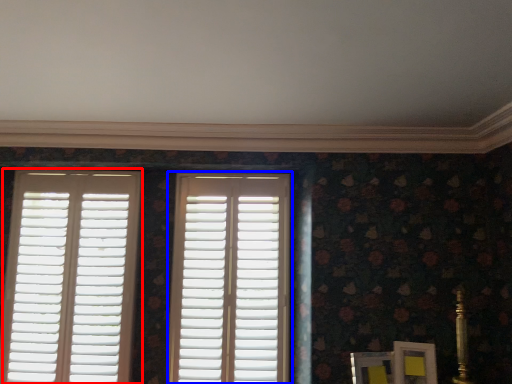
Question: Which object appears farthest to the camera in this image, window (highlighted by a red box) or window (highlighted by a blue box)?

Choices:
 (A) window
 (B) window

Answer: (A)